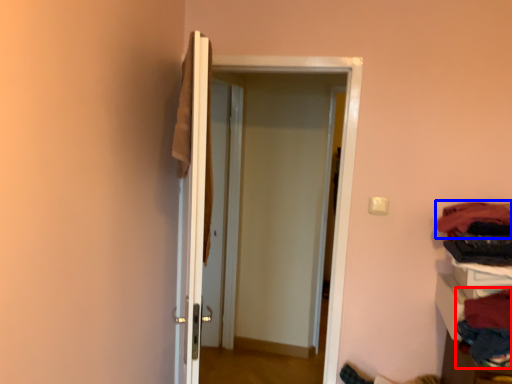
Question: Which object is closer to the camera taking this photo, clothing (highlighted by a red box) or clothing (highlighted by a blue box)?

Choices:
 (A) clothing
 (B) clothing

Answer: (A)